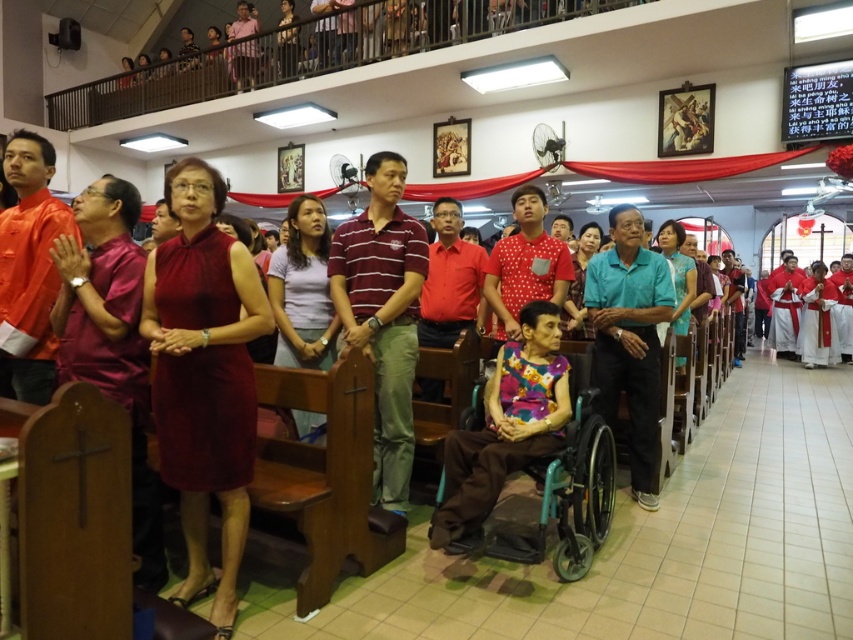
You are a photographer planning to capture a group photo of the maroon satin dress at center and the teal fabric shirt at center. To ensure both subjects are fully visible in the frame, which subject should you position closer to the camera?

The maroon satin dress at center is wider than the teal fabric shirt at center. To ensure both are fully visible, position the wider maroon satin dress at center closer to the camera so its larger size can be accommodated within the frame.

You are a service robot with a 3.5 feet wide base. You need to navigate from the entrance to the altar, which is behind the maroon satin dress at center and teal fabric shirt at center. Can you pass between them?

The distance between maroon satin dress at center and teal fabric shirt at center is 6.83 feet. Since your base is 3.5 feet wide, you can safely navigate through the space between them as the distance is wider than your base.

You are standing at the entrance of the church and want to move towards the point marked as point (215,620). There is an obstacle at point (604,433). Will you encounter this obstacle on your path?

Since point (215,620) is in front of point (604,433), you will reach point (215,620) before encountering the obstacle at point (604,433).